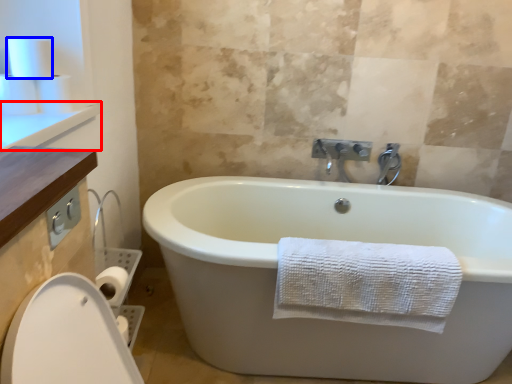
Question: Among these objects, which one is farthest to the camera, counter top (highlighted by a red box) or toilet paper (highlighted by a blue box)?

Choices:
 (A) counter top
 (B) toilet paper

Answer: (B)